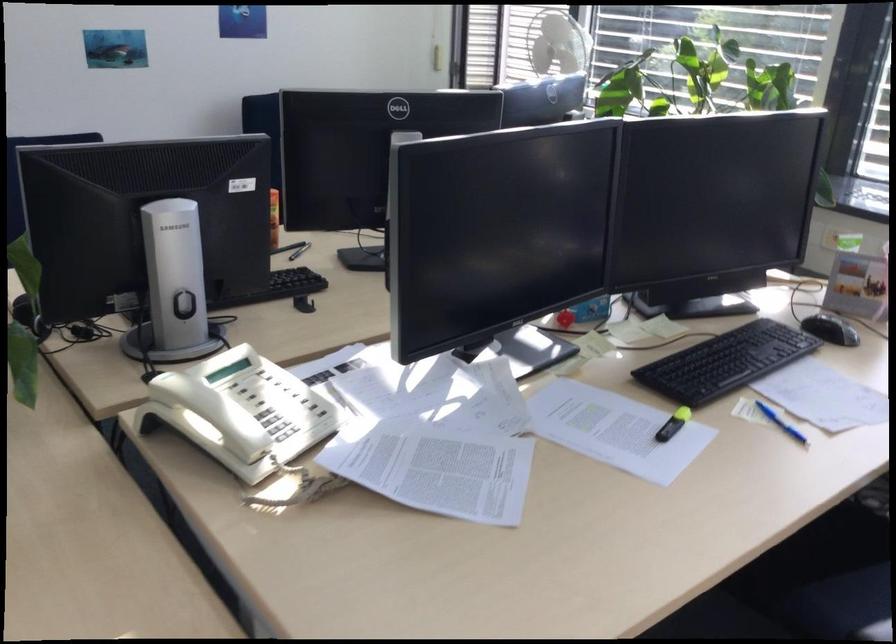
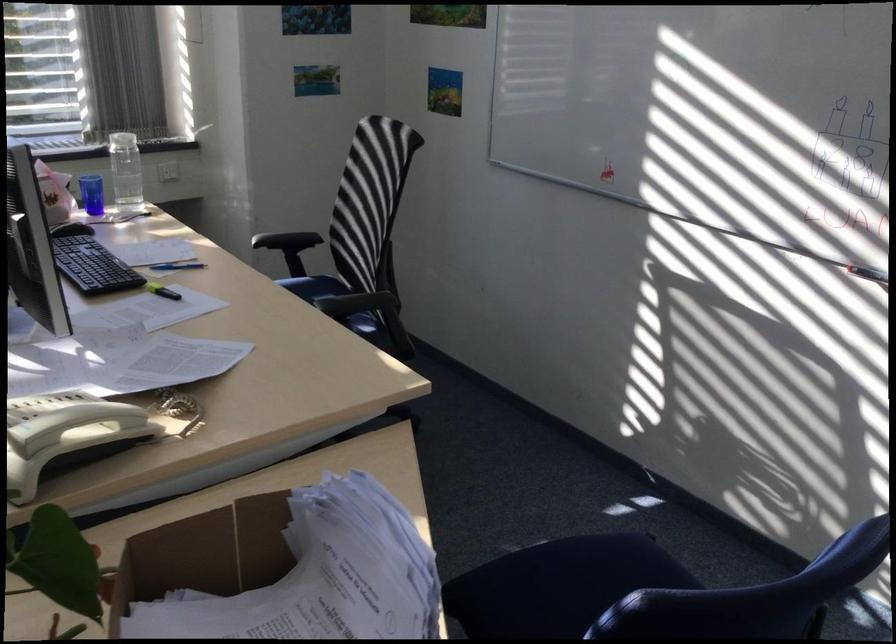
Find the pixel in the second image that matches (x=676, y=424) in the first image.

(161, 290)